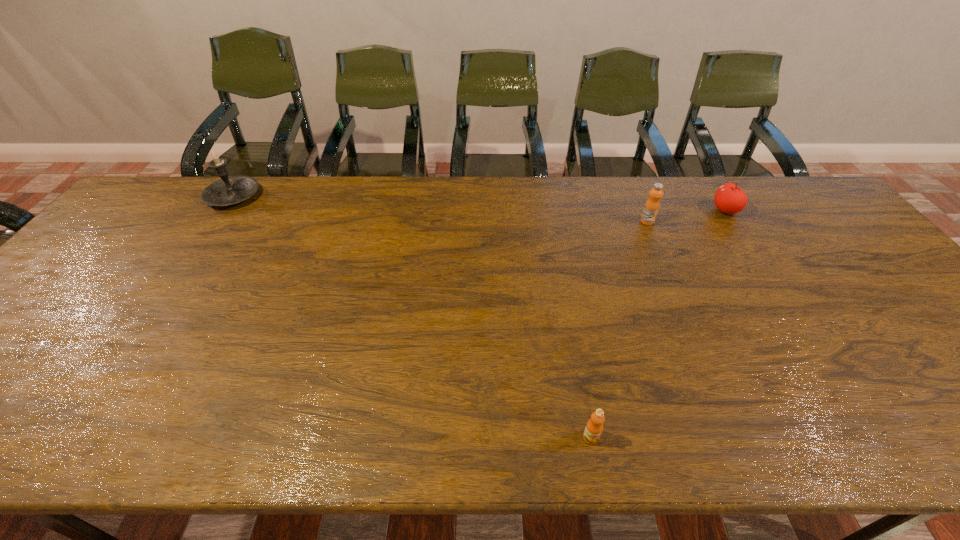
The height and width of the screenshot is (540, 960). Find the location of `candle`. candle is located at coordinates (230, 190).

Identify the location of the tallest object. (230, 190).

Where is `the right orange juice`? The height and width of the screenshot is (540, 960). the right orange juice is located at coordinates (652, 205).

Locate an element on the screen. the third object from left to right is located at coordinates (652, 205).

Locate an element on the screen. apple is located at coordinates (730, 199).

Identify the location of the nearest object. Image resolution: width=960 pixels, height=540 pixels. (594, 427).

Locate an element on the screen. the shorter orange juice is located at coordinates (594, 427).

Where is `free region located on the right of the leftmost object`? free region located on the right of the leftmost object is located at coordinates (290, 197).

The height and width of the screenshot is (540, 960). In order to click on free space located 0.320m on the front label of the taller orange juice in this screenshot , I will do `click(684, 305)`.

Find the location of `blank space located 0.290m on the right of the rightmost object`. blank space located 0.290m on the right of the rightmost object is located at coordinates (830, 211).